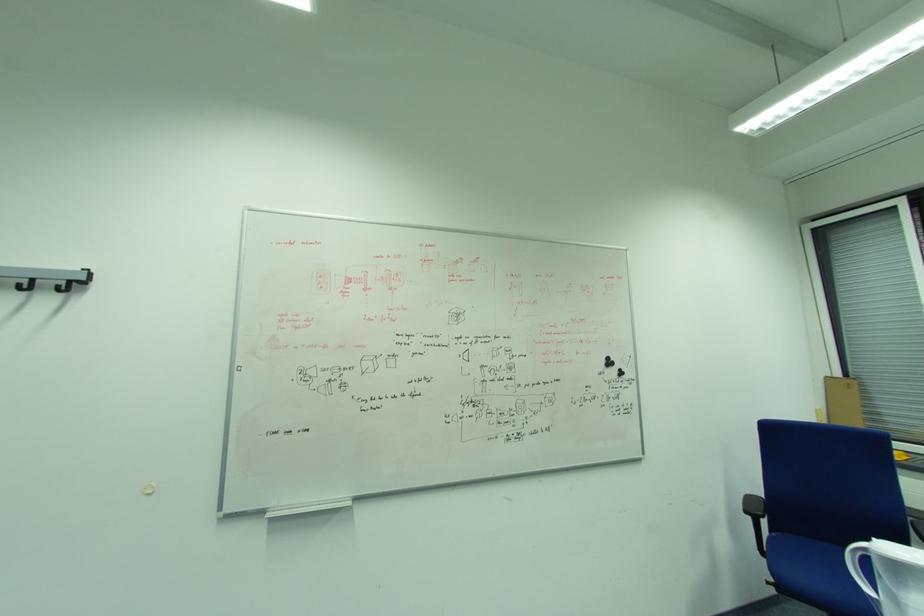
Find where to sit the blue chair sitting surface. Please return your answer as a coordinate pair (x, y).

(807, 569)